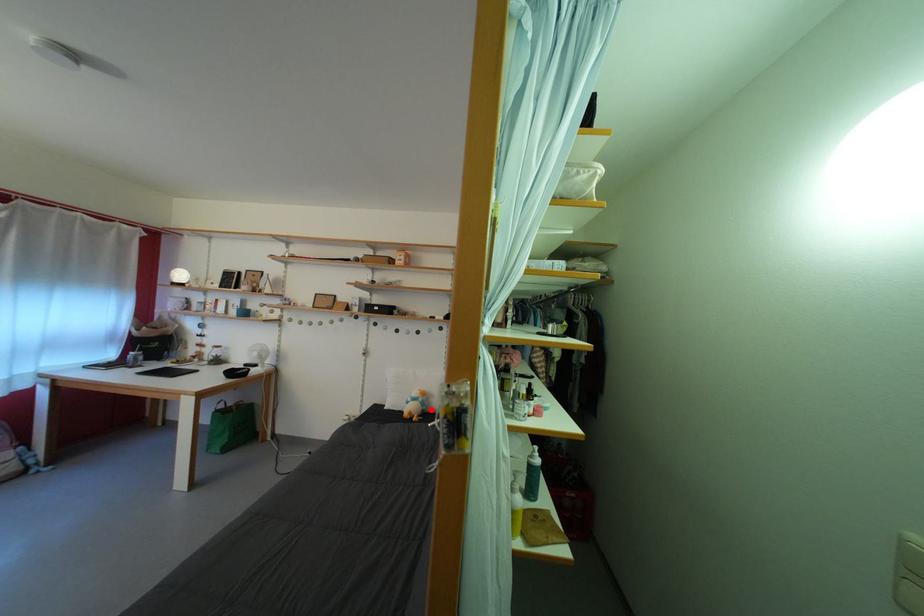
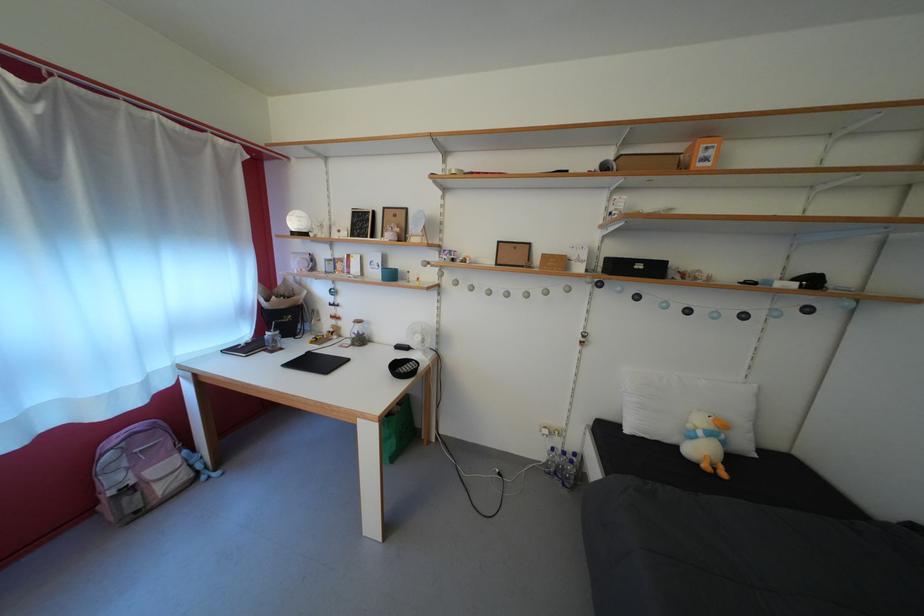
Where in the second image is the point corresponding to the highlighted location from the first image?

(732, 448)